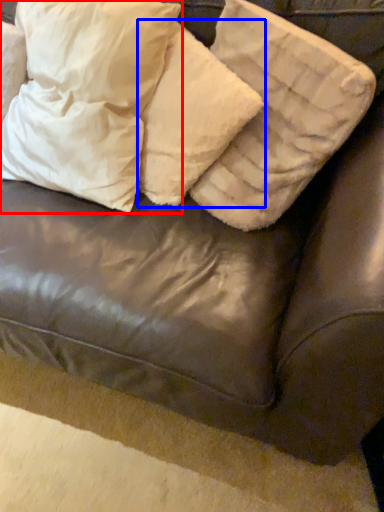
Question: Which object appears farthest to the camera in this image, pillow (highlighted by a red box) or pillow (highlighted by a blue box)?

Choices:
 (A) pillow
 (B) pillow

Answer: (B)